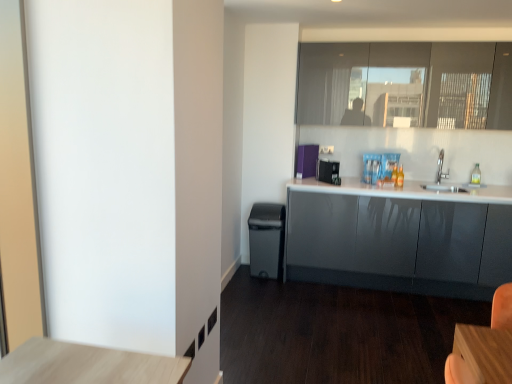
The height and width of the screenshot is (384, 512). In order to click on empty space that is to the right of transparent plastic bottle at right in this screenshot , I will do `click(488, 181)`.